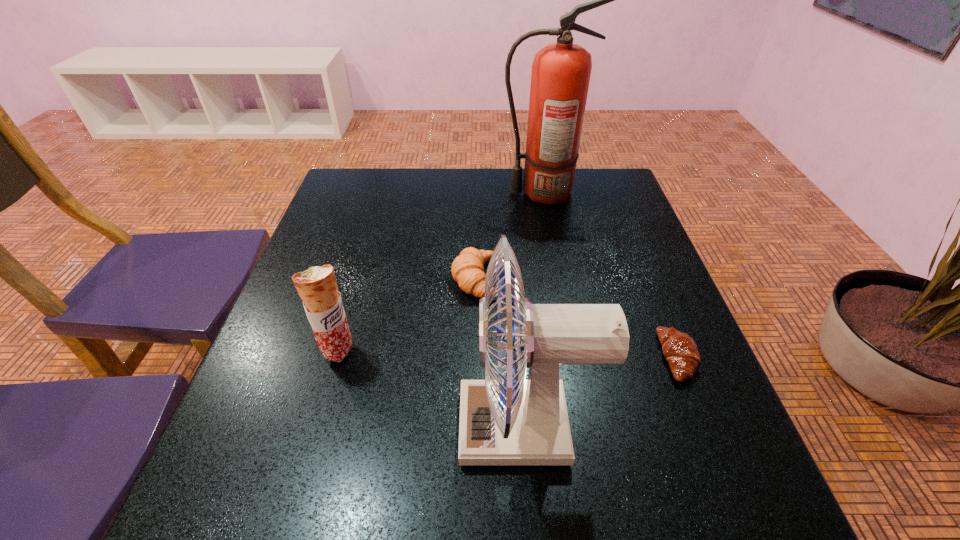
Image resolution: width=960 pixels, height=540 pixels. Find the location of `the farthest object`. the farthest object is located at coordinates (561, 71).

Identify the location of fire extinguisher. The image size is (960, 540). (561, 71).

Locate an element on the screen. Image resolution: width=960 pixels, height=540 pixels. the second tallest object is located at coordinates (514, 421).

Image resolution: width=960 pixels, height=540 pixels. I want to click on the leftmost object, so click(x=317, y=287).

Locate an element on the screen. This screenshot has width=960, height=540. burrito is located at coordinates (317, 287).

Find the location of `the farther crescent roll`. the farther crescent roll is located at coordinates (467, 269).

This screenshot has width=960, height=540. I want to click on the taller crescent roll, so click(x=467, y=269).

You are a GUI agent. You are given a task and a screenshot of the screen. Output one action in this format:
    pyautogui.click(x=<x>, y=<y>)
    Task: Click on the rightmost object
    
    Given the screenshot: What is the action you would take?
    pyautogui.click(x=679, y=349)

Find the location of a particular element. the shortest object is located at coordinates (679, 349).

Where is `blank space located on the nozzle of the tallest object`? blank space located on the nozzle of the tallest object is located at coordinates (444, 192).